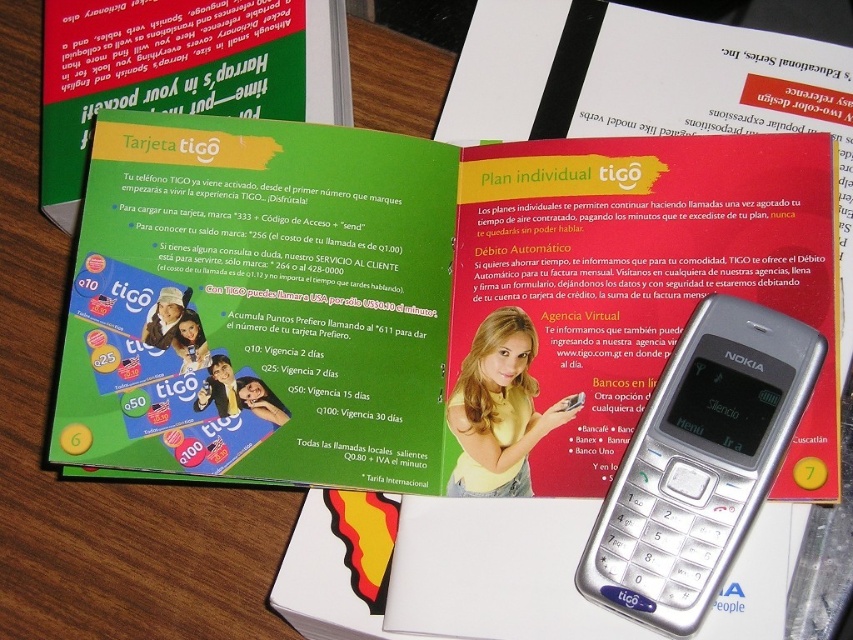
Question: Does green matte card at center have a larger size compared to silver metallic nokia phone at center-right?

Choices:
 (A) yes
 (B) no

Answer: (A)

Question: Observing the image, what is the correct spatial positioning of silver metallic nokia phone at center-right in reference to green matte card at upper left?

Choices:
 (A) above
 (B) below

Answer: (B)

Question: Considering the relative positions of silver metallic nokia phone at center-right and green matte card at upper left in the image provided, where is silver metallic nokia phone at center-right located with respect to green matte card at upper left?

Choices:
 (A) below
 (B) above

Answer: (A)

Question: Which point is closer to the camera?

Choices:
 (A) (744, 515)
 (B) (186, 72)
 (C) (337, 138)

Answer: (A)

Question: Which of these objects is positioned farthest from the green matte card at center?

Choices:
 (A) silver metallic nokia phone at center-right
 (B) matte plastic booklet at center

Answer: (A)

Question: Which point is closer to the camera taking this photo?

Choices:
 (A) (630, 570)
 (B) (136, 65)
 (C) (450, 173)

Answer: (A)